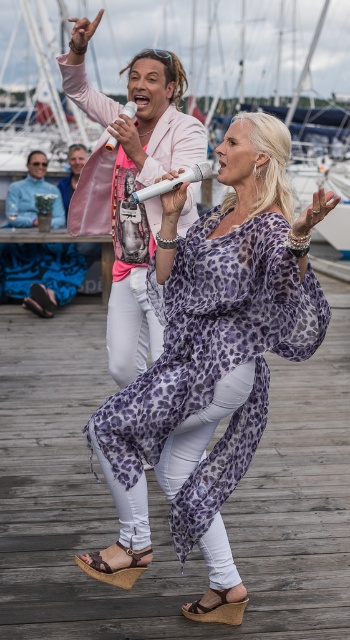
Can you confirm if brown suede sandal at lower center is thinner than brown leather sandal at lower center?

Yes, brown suede sandal at lower center is thinner than brown leather sandal at lower center.

Is brown suede sandal at lower center above brown leather sandal at lower center?

Actually, brown suede sandal at lower center is below brown leather sandal at lower center.

Identify the location of brown suede sandal at lower center. This screenshot has height=640, width=350. (218, 611).

Identify the location of brown suede sandal at lower center. The height and width of the screenshot is (640, 350). (218, 611).

Is purple leopard print dress at center shorter than brown suede sandal at lower center?

No, purple leopard print dress at center is not shorter than brown suede sandal at lower center.

Which is in front, point (208, 544) or point (222, 593)?

Point (208, 544) is in front.

Where is `purple leopard print dress at center`? This screenshot has width=350, height=640. purple leopard print dress at center is located at coordinates (214, 348).

Is light blue shirt at upper left smaller than brown leather sandal at lower center?

No.

Which of these two, light blue shirt at upper left or brown leather sandal at lower center, stands taller?

With more height is light blue shirt at upper left.

Who is more distant from viewer, (64, 179) or (29, 298)?

Positioned behind is point (64, 179).

Find the location of a particular element. light blue shirt at upper left is located at coordinates (72, 172).